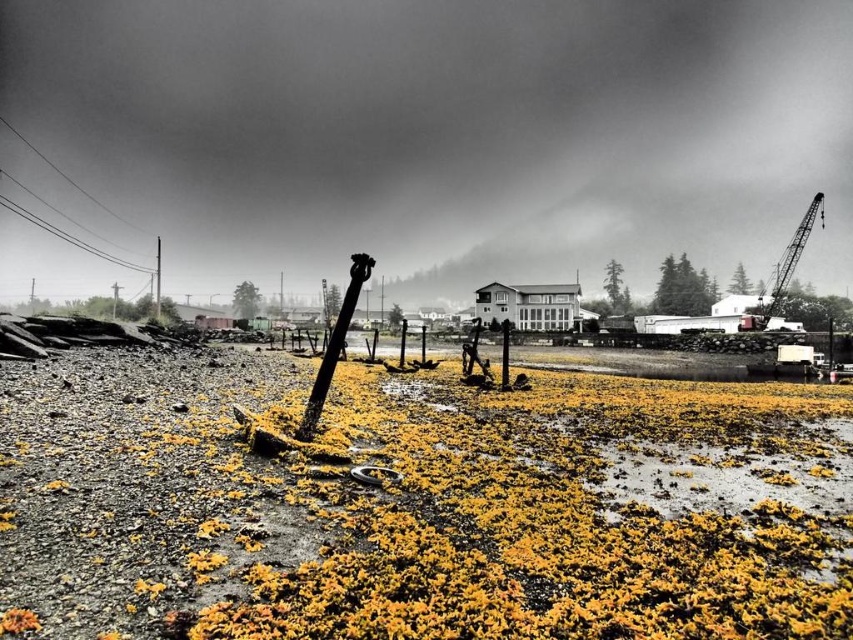
Image resolution: width=853 pixels, height=640 pixels. What are the coordinates of `yellow mossy mud at center` in the screenshot? It's located at [x=416, y=506].

Can you confirm if yellow mossy mud at center is thinner than brushed metal telegraph pole at upper left?

Yes, yellow mossy mud at center is thinner than brushed metal telegraph pole at upper left.

The width and height of the screenshot is (853, 640). I want to click on yellow mossy mud at center, so click(x=416, y=506).

I want to click on yellow mossy mud at center, so click(x=416, y=506).

Between yellow mossy mud at center and metallic gray crane at upper right, which one appears on the right side from the viewer's perspective?

From the viewer's perspective, metallic gray crane at upper right appears more on the right side.

Can you confirm if yellow mossy mud at center is thinner than metallic gray crane at upper right?

Yes, yellow mossy mud at center is thinner than metallic gray crane at upper right.

Is point (787, 604) positioned behind point (782, 289)?

No, it is not.

The image size is (853, 640). What are the coordinates of `yellow mossy mud at center` in the screenshot? It's located at (416, 506).

In the scene shown: Can you confirm if metallic gray crane at upper right is positioned to the right of brushed metal telegraph pole at upper left?

Correct, you'll find metallic gray crane at upper right to the right of brushed metal telegraph pole at upper left.

Is metallic gray crane at upper right below brushed metal telegraph pole at upper left?

Incorrect, metallic gray crane at upper right is not positioned below brushed metal telegraph pole at upper left.

Where is `metallic gray crane at upper right`? This screenshot has height=640, width=853. metallic gray crane at upper right is located at coordinates (791, 259).